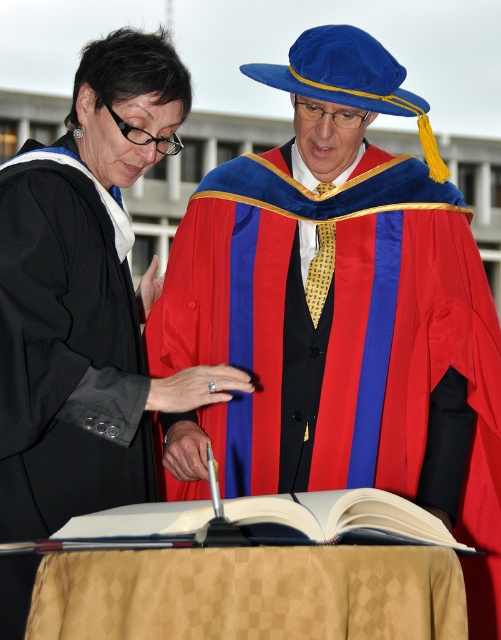
Is velvet blue graduation gown at center thinner than white paper book at center?

In fact, velvet blue graduation gown at center might be wider than white paper book at center.

Where is `velvet blue graduation gown at center`? The width and height of the screenshot is (501, 640). velvet blue graduation gown at center is located at coordinates (330, 296).

Describe the element at coordinates (330, 296) in the screenshot. I see `velvet blue graduation gown at center` at that location.

The width and height of the screenshot is (501, 640). I want to click on velvet blue graduation gown at center, so (x=330, y=296).

In the scene shown: Does matte black robe at left appear on the left side of white paper book at center?

Correct, you'll find matte black robe at left to the left of white paper book at center.

Is matte black robe at left above white paper book at center?

Correct, matte black robe at left is located above white paper book at center.

Who is more distant from viewer, (33, 497) or (309, 492)?

The point (309, 492) is more distant.

This screenshot has height=640, width=501. In order to click on matte black robe at left in this screenshot , I will do coord(66,356).

Is point (372, 180) positioned in front of point (3, 442)?

That is False.

Which is in front, point (317, 364) or point (52, 243)?

Point (52, 243) is more forward.

Where is `velvet blue graduation gown at center`? Image resolution: width=501 pixels, height=640 pixels. velvet blue graduation gown at center is located at coordinates (330, 296).